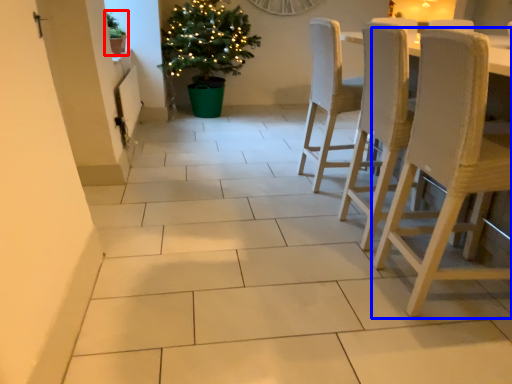
Question: Which object appears farthest to the camera in this image, houseplant (highlighted by a red box) or chair (highlighted by a blue box)?

Choices:
 (A) houseplant
 (B) chair

Answer: (A)